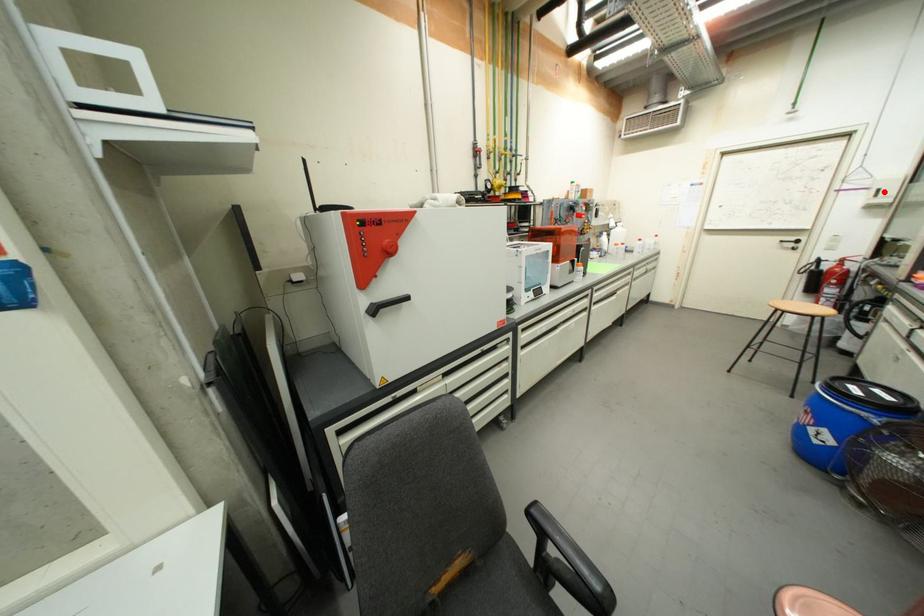
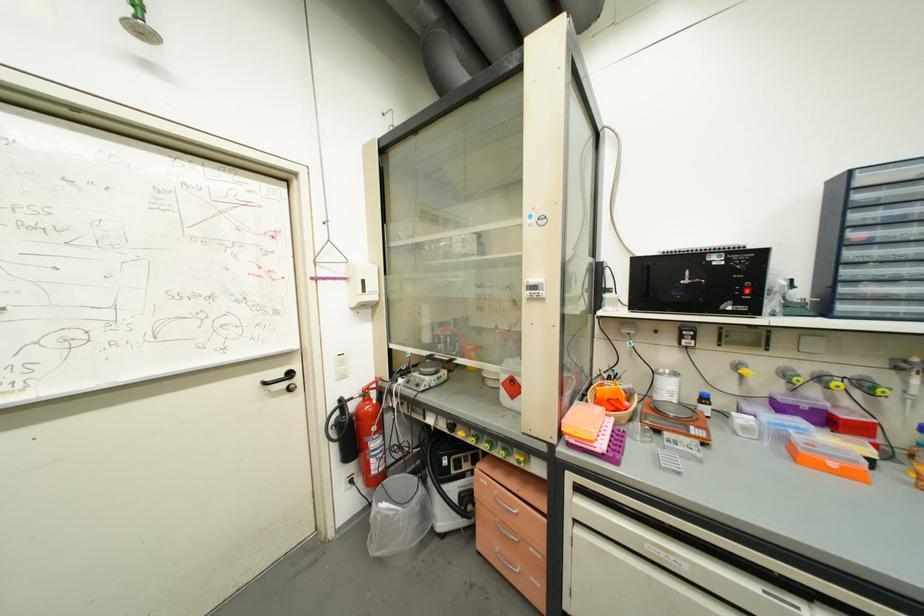
Question: I am providing you with two images of the same scene from different viewpoints. In image1, a red point is highlighted. Considering the same 3D point in image2, which of the following is correct?

Choices:
 (A) It is closer
 (B) It is farther

Answer: (A)